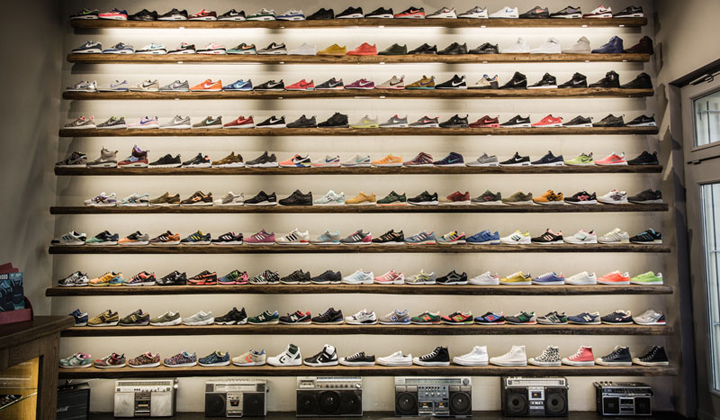
Locate an element on the screen. The image size is (720, 420). rows of display shelf is located at coordinates (338, 23), (336, 58), (335, 92), (337, 131), (337, 169), (336, 208), (333, 248), (332, 287), (332, 327), (332, 371).